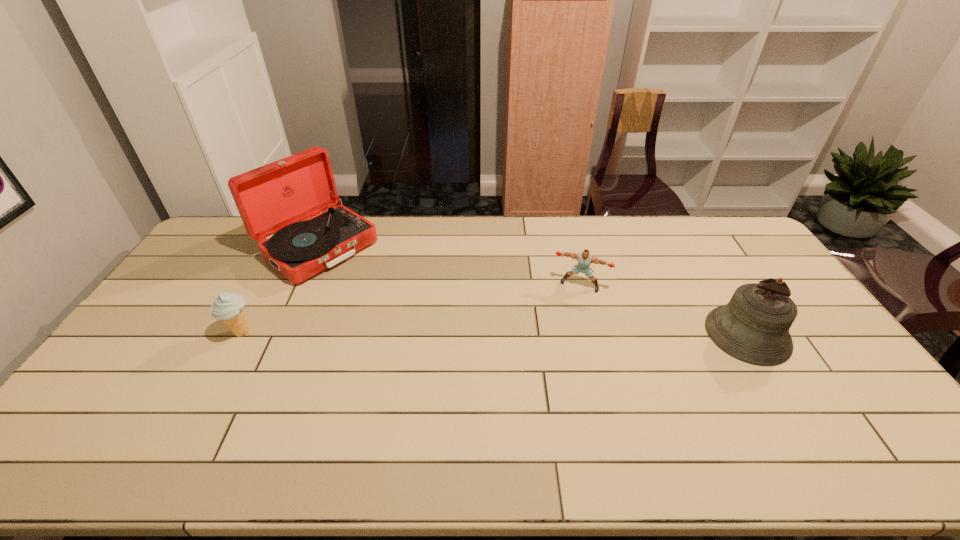
Image resolution: width=960 pixels, height=540 pixels. I want to click on free region located 0.090m on the front-facing side of the tallest object, so click(370, 285).

You are a GUI agent. You are given a task and a screenshot of the screen. Output one action in this format:
    pyautogui.click(x=<x>, y=<y>)
    Task: Click on the vacant space located on the front-facing side of the tallest object
    Image resolution: width=960 pixels, height=540 pixels.
    Given the screenshot: What is the action you would take?
    pyautogui.click(x=425, y=325)

Locate an element on the screen. This screenshot has height=540, width=960. vacant space located on the front-facing side of the tallest object is located at coordinates (370, 285).

Identify the location of object at the far edge. This screenshot has width=960, height=540. (273, 200).

At what (x,y) coordinates should I click in order to perform the action: click on object at the right edge. Please return your answer as a coordinate pair (x, y). The width and height of the screenshot is (960, 540). Looking at the image, I should click on (753, 327).

The height and width of the screenshot is (540, 960). I want to click on vacant area at the far edge of the desktop, so click(x=468, y=226).

In the image, there is a desktop. Identify the location of vacant space at the near edge. (331, 405).

Locate an element on the screen. free spot at the right edge of the desktop is located at coordinates (739, 268).

Find the location of `free region at the far right corner of the desktop`. free region at the far right corner of the desktop is located at coordinates (737, 238).

Identify the location of vacant area that lies between the phonograph_record and the second object from right to left. (449, 266).